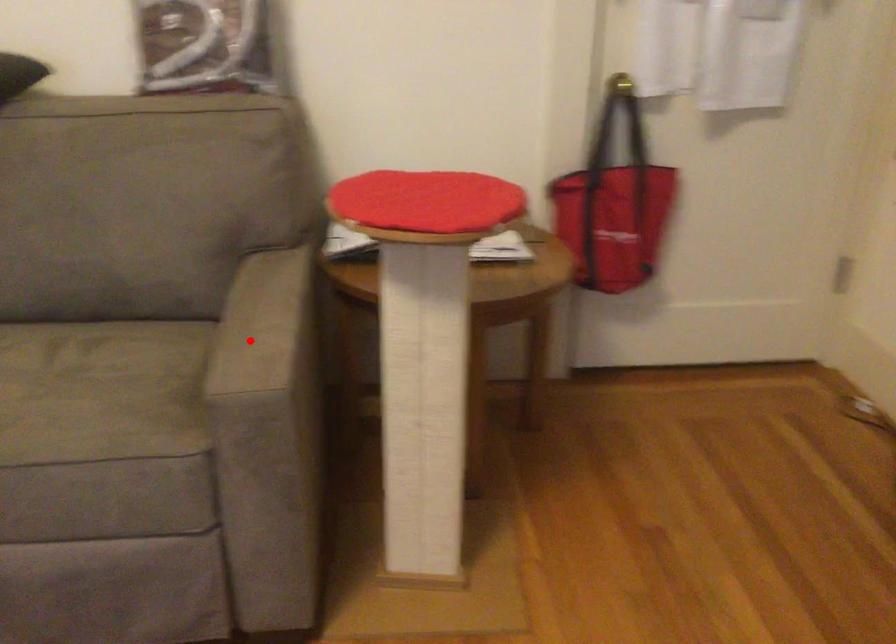
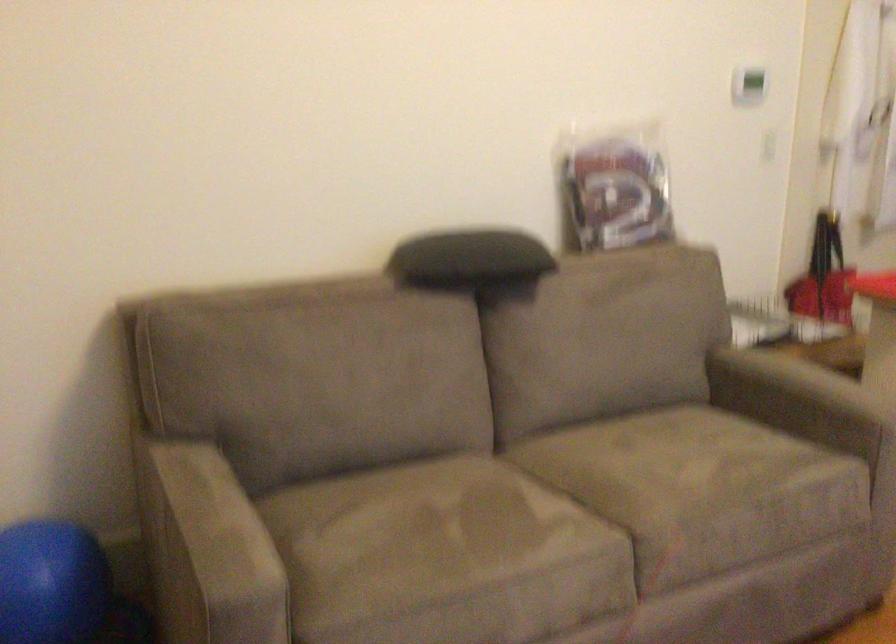
Where in the second image is the point corresponding to the highlighted location from the first image?

(798, 400)